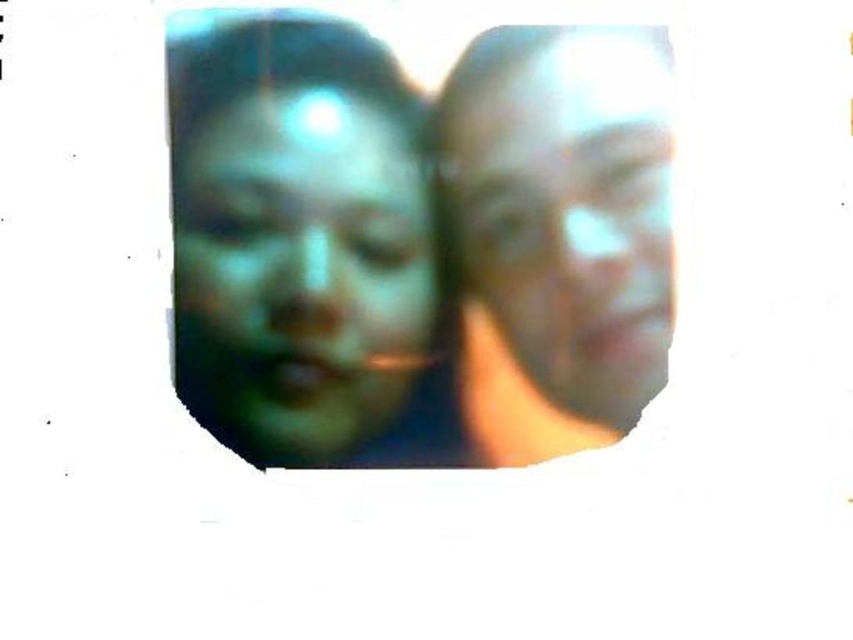
Question: Does green matte face at center have a lesser width compared to smooth skin face at right?

Choices:
 (A) yes
 (B) no

Answer: (B)

Question: Which point is farther to the camera?

Choices:
 (A) smooth skin face at right
 (B) green matte face at center

Answer: (B)

Question: Does green matte face at center appear on the left side of smooth skin face at right?

Choices:
 (A) no
 (B) yes

Answer: (B)

Question: Which point is closer to the camera taking this photo?

Choices:
 (A) click(567, 163)
 (B) click(289, 307)

Answer: (A)

Question: Does green matte face at center appear on the left side of smooth skin face at right?

Choices:
 (A) yes
 (B) no

Answer: (A)

Question: Which point is farther from the camera taking this photo?

Choices:
 (A) [x=511, y=156]
 (B) [x=395, y=378]

Answer: (B)